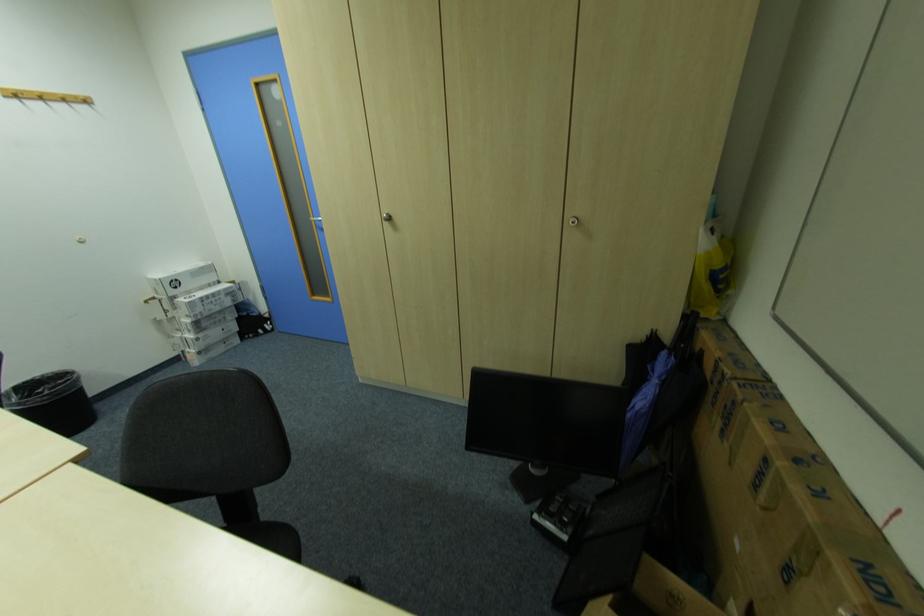
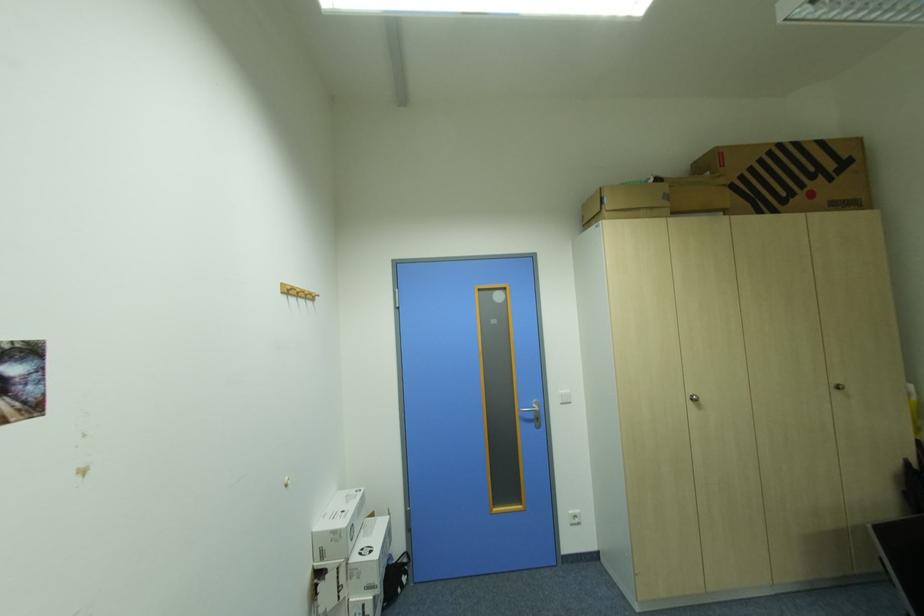
Find the pixel in the second image that matches pixel 163 281 in the first image.

(341, 533)